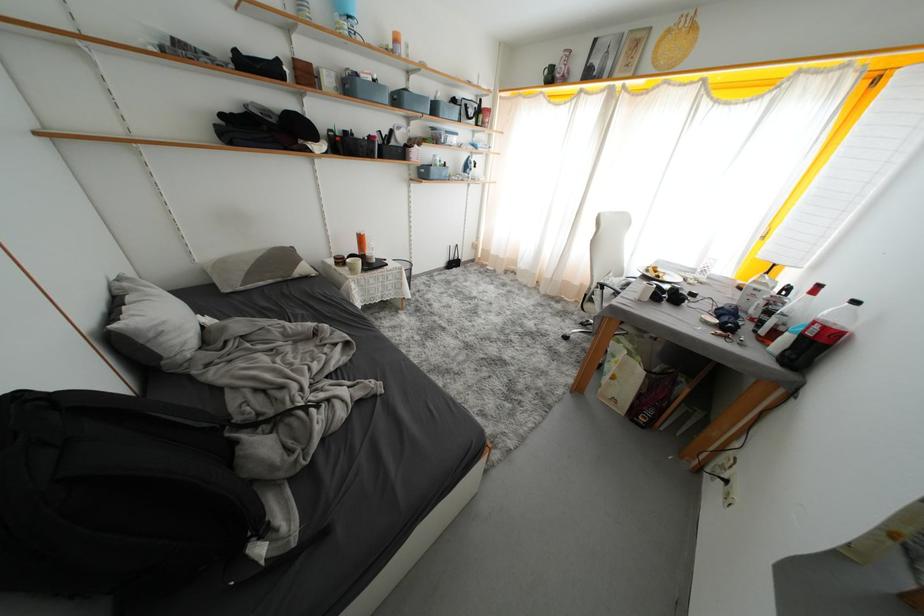
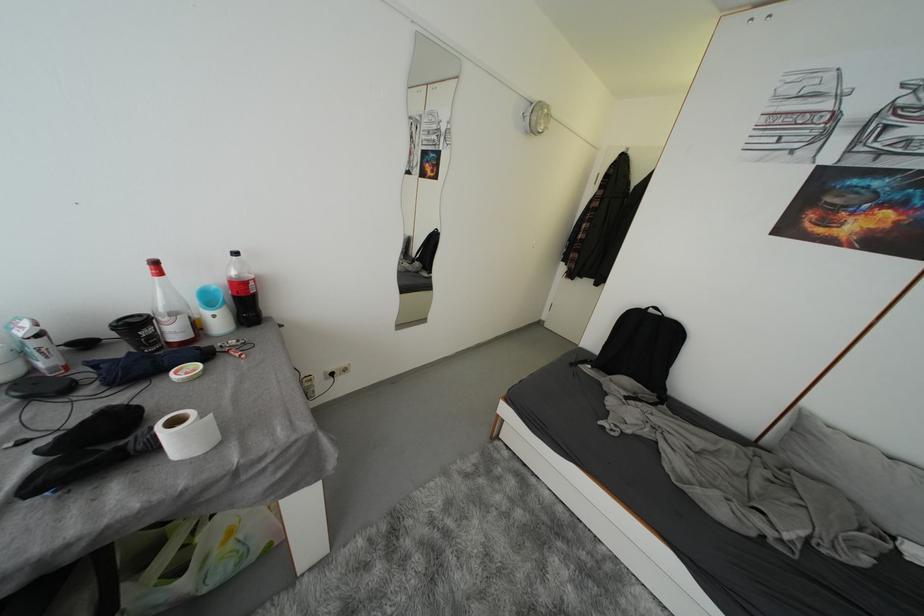
Find the pixel in the second image that matches point 825,291 in the first image.

(162, 267)